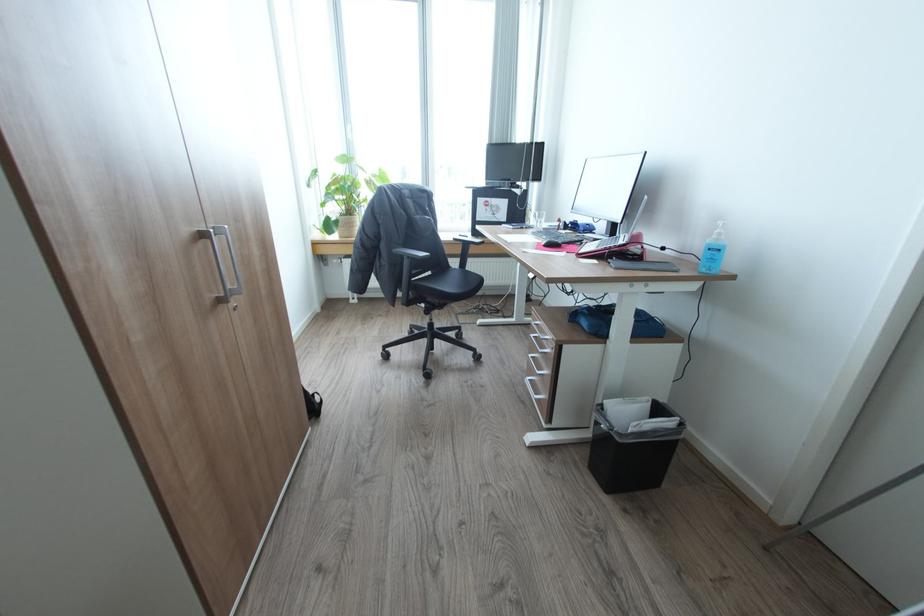
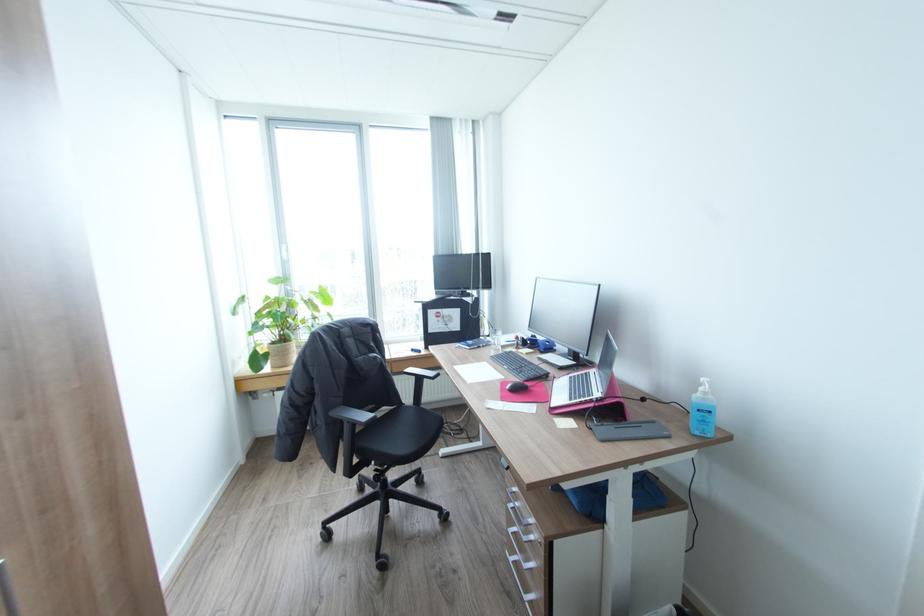
Find the pixel in the second image that matches (346,215) in the first image.

(277, 342)